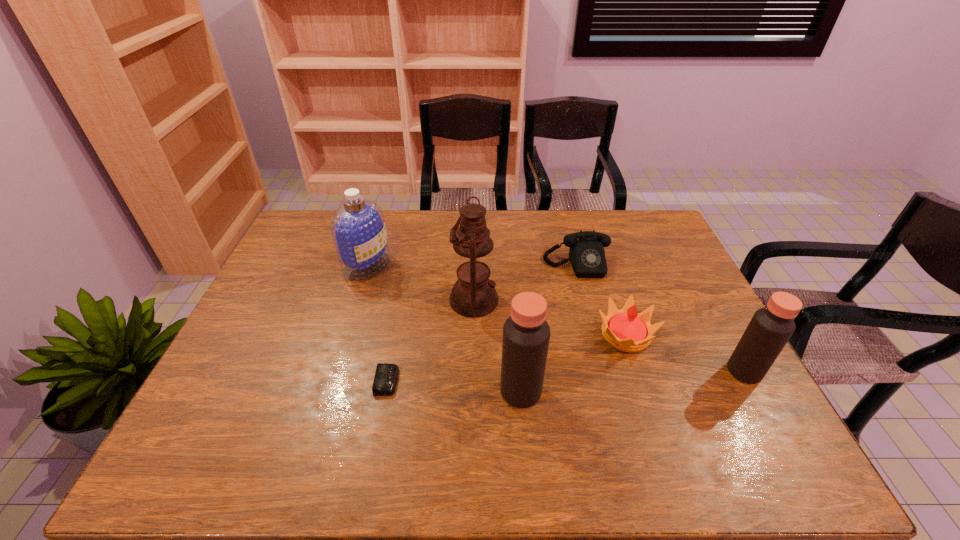
This screenshot has width=960, height=540. What are the coordinates of `vacant space located 0.150m on the back of the right vinegar` in the screenshot? It's located at (714, 317).

Identify the location of free space located 0.110m on the dial of the second shortest object. click(588, 303).

Where is `free region located on the back of the cleansing agent`? The image size is (960, 540). free region located on the back of the cleansing agent is located at coordinates (377, 232).

You are a GUI agent. You are given a task and a screenshot of the screen. Output one action in this format:
    pyautogui.click(x=<x>, y=<y>)
    Task: Click on the vacant space located 0.150m on the front of the oil lamp
    
    Given the screenshot: What is the action you would take?
    pyautogui.click(x=473, y=365)

The image size is (960, 540). I want to click on vacant space positioned on the left of the crown, so click(x=451, y=335).

Locate an element on the screen. vacant space located 0.360m on the display of the shortest object is located at coordinates (541, 381).

This screenshot has width=960, height=540. In order to click on vinegar at the near edge in this screenshot , I will do `click(526, 334)`.

Where is `alarm clock located in the near edge section of the desktop`? The width and height of the screenshot is (960, 540). alarm clock located in the near edge section of the desktop is located at coordinates (386, 375).

Image resolution: width=960 pixels, height=540 pixels. I want to click on object at the right edge, so click(770, 328).

Locate an element on the screen. This screenshot has height=540, width=960. vacant region at the far edge of the desktop is located at coordinates (515, 210).